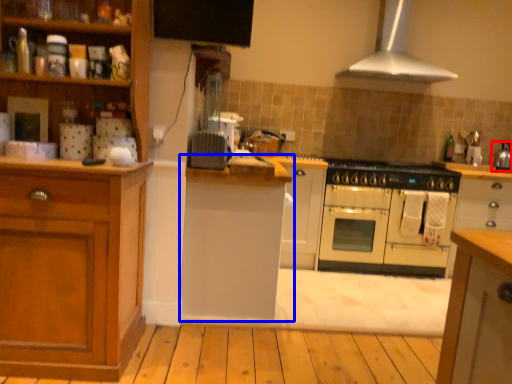
Question: Which object appears farthest to the camera in this image, kitchen appliance (highlighted by a red box) or cabinetry (highlighted by a blue box)?

Choices:
 (A) kitchen appliance
 (B) cabinetry

Answer: (A)